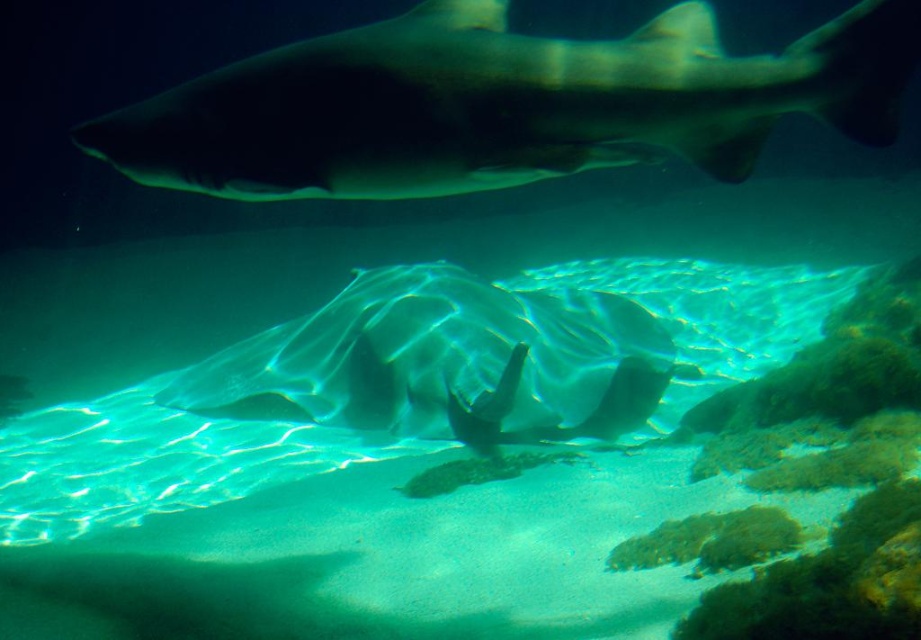
Is smooth gray shark at upper center further to camera compared to translucent white shark at center?

That is False.

Is point (678, 84) positioned behind point (465, 316)?

No, it is not.

Is point (865, 22) less distant than point (421, 312)?

That is True.

You are a GUI agent. You are given a task and a screenshot of the screen. Output one action in this format:
    pyautogui.click(x=<x>, y=<y>)
    Task: Click on the smooth gray shark at upper center
    This screenshot has width=921, height=640.
    Given the screenshot: What is the action you would take?
    pyautogui.click(x=500, y=104)